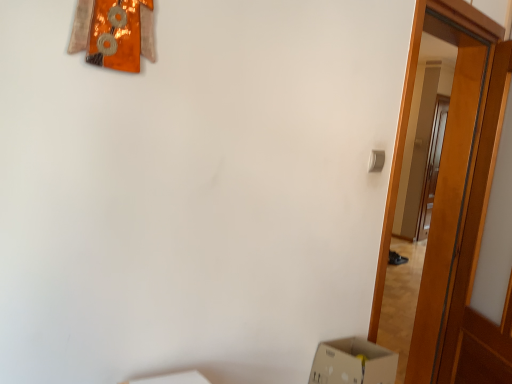
Describe the element at coordinates (441, 171) in the screenshot. I see `wooden door at right, the second door in the right-to-left sequence` at that location.

Where is `wooden door at right, which is the 1th door in left-to-right order`? wooden door at right, which is the 1th door in left-to-right order is located at coordinates (441, 171).

In order to face wooden door at right, the second door in the right-to-left sequence, should I rotate leftwards or rightwards?

You should rotate right by 20.613 degrees.

Measure the distance between point [500,346] and camera.

Point [500,346] is 6.70 feet away from camera.

What do you see at coordinates (477, 258) in the screenshot? Image resolution: width=512 pixels, height=384 pixels. I see `wooden door at right, acting as the 2th door starting from the left` at bounding box center [477, 258].

In order to click on wooden door at right, acting as the 1th door starting from the right in this screenshot , I will do `click(477, 258)`.

This screenshot has height=384, width=512. I want to click on wooden door at right, the second door in the right-to-left sequence, so click(x=441, y=171).

Is wooden door at right, acting as the 1th door starting from the right, to the left of wooden door at right, which is the 1th door in left-to-right order, from the viewer's perspective?

Incorrect, wooden door at right, acting as the 1th door starting from the right, is not on the left side of wooden door at right, which is the 1th door in left-to-right order.

Consider the image. Is the depth of wooden door at right, acting as the 2th door starting from the left, greater than that of wooden door at right, which is the 1th door in left-to-right order?

Yes, wooden door at right, acting as the 2th door starting from the left, is further from the viewer.

Considering the positions of point (494, 81) and point (417, 50), is point (494, 81) closer or farther from the camera than point (417, 50)?

Point (494, 81).

From the image's perspective, who appears lower, wooden door at right, acting as the 1th door starting from the right, or wooden door at right, the second door in the right-to-left sequence?

wooden door at right, acting as the 1th door starting from the right, is shown below in the image.

From a real-world perspective, is wooden door at right, acting as the 2th door starting from the left, positioned under wooden door at right, the second door in the right-to-left sequence, based on gravity?

No, from a real-world perspective, wooden door at right, acting as the 2th door starting from the left, is not beneath wooden door at right, the second door in the right-to-left sequence.

Considering the sizes of objects wooden door at right, acting as the 2th door starting from the left, and wooden door at right, the second door in the right-to-left sequence, in the image provided, who is thinner, wooden door at right, acting as the 2th door starting from the left, or wooden door at right, the second door in the right-to-left sequence,?

wooden door at right, acting as the 2th door starting from the left.

In terms of height, does wooden door at right, acting as the 2th door starting from the left, look taller or shorter compared to wooden door at right, the second door in the right-to-left sequence?

Considering their sizes, wooden door at right, acting as the 2th door starting from the left, has less height than wooden door at right, the second door in the right-to-left sequence.

Considering the relative sizes of wooden door at right, acting as the 2th door starting from the left, and wooden door at right, the second door in the right-to-left sequence, in the image provided, is wooden door at right, acting as the 2th door starting from the left, bigger than wooden door at right, the second door in the right-to-left sequence,?

No.

Is wooden door at right, acting as the 1th door starting from the right, inside or outside of wooden door at right, the second door in the right-to-left sequence?

The correct answer is: outside.

Is wooden door at right, acting as the 2th door starting from the left, not near wooden door at right, which is the 1th door in left-to-right order?

wooden door at right, acting as the 2th door starting from the left, is actually quite close to wooden door at right, which is the 1th door in left-to-right order.

Is wooden door at right, acting as the 2th door starting from the left, aimed at wooden door at right, the second door in the right-to-left sequence?

Yes.

Can you tell me how much wooden door at right, acting as the 2th door starting from the left, and wooden door at right, the second door in the right-to-left sequence, differ in facing direction?

122 degrees.

Locate an element on the screen. door above the wooden door at right, which is the 1th door in left-to-right order (from a real-world perspective) is located at coordinates (477, 258).

Visually, is wooden door at right, the second door in the right-to-left sequence, positioned to the left or to the right of wooden door at right, acting as the 1th door starting from the right?

In the image, wooden door at right, the second door in the right-to-left sequence, appears on the left side of wooden door at right, acting as the 1th door starting from the right.

Does wooden door at right, which is the 1th door in left-to-right order, come in front of wooden door at right, acting as the 1th door starting from the right?

Yes, wooden door at right, which is the 1th door in left-to-right order, is closer to the viewer.

Considering the points (454, 31) and (480, 152), which point is in front, point (454, 31) or point (480, 152)?

The point (454, 31) is closer.

From the image's perspective, which one is positioned lower, wooden door at right, the second door in the right-to-left sequence, or wooden door at right, acting as the 1th door starting from the right?

wooden door at right, acting as the 1th door starting from the right, appears lower in the image.

From a real-world perspective, which is physically above, wooden door at right, the second door in the right-to-left sequence, or wooden door at right, acting as the 2th door starting from the left?

wooden door at right, acting as the 2th door starting from the left.

Considering the sizes of objects wooden door at right, the second door in the right-to-left sequence, and wooden door at right, acting as the 1th door starting from the right, in the image provided, who is thinner, wooden door at right, the second door in the right-to-left sequence, or wooden door at right, acting as the 1th door starting from the right,?

wooden door at right, acting as the 1th door starting from the right, is thinner.

Who is shorter, wooden door at right, the second door in the right-to-left sequence, or wooden door at right, acting as the 1th door starting from the right?

Standing shorter between the two is wooden door at right, acting as the 1th door starting from the right.

Considering the sizes of objects wooden door at right, the second door in the right-to-left sequence, and wooden door at right, acting as the 2th door starting from the left, in the image provided, who is bigger, wooden door at right, the second door in the right-to-left sequence, or wooden door at right, acting as the 2th door starting from the left,?

With larger size is wooden door at right, the second door in the right-to-left sequence.

Is wooden door at right, acting as the 1th door starting from the right, a part of wooden door at right, which is the 1th door in left-to-right order?

That's incorrect, wooden door at right, acting as the 1th door starting from the right, is not inside wooden door at right, which is the 1th door in left-to-right order.

Is wooden door at right, which is the 1th door in left-to-right order, positioned far away from wooden door at right, acting as the 2th door starting from the left?

That's not correct — wooden door at right, which is the 1th door in left-to-right order, is a little close to wooden door at right, acting as the 2th door starting from the left.

Is wooden door at right, which is the 1th door in left-to-right order, positioned with its back to wooden door at right, acting as the 2th door starting from the left?

Correct, wooden door at right, which is the 1th door in left-to-right order, is looking away from wooden door at right, acting as the 2th door starting from the left.

This screenshot has height=384, width=512. I want to click on door located underneath the wooden door at right, acting as the 2th door starting from the left (from a real-world perspective), so click(x=441, y=171).

This screenshot has width=512, height=384. Identify the location of door in front of the wooden door at right, acting as the 1th door starting from the right. (441, 171).

Where is `door above the wooden door at right, acting as the 1th door starting from the right (from the image's perspective)`? The image size is (512, 384). door above the wooden door at right, acting as the 1th door starting from the right (from the image's perspective) is located at coordinates (441, 171).